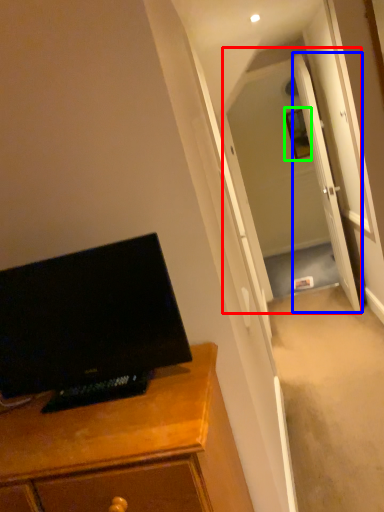
Question: Based on their relative distances, which object is farther from glass door (highlighted by a red box)? Choose from door (highlighted by a blue box) and picture frame (highlighted by a green box).

Choices:
 (A) door
 (B) picture frame

Answer: (B)